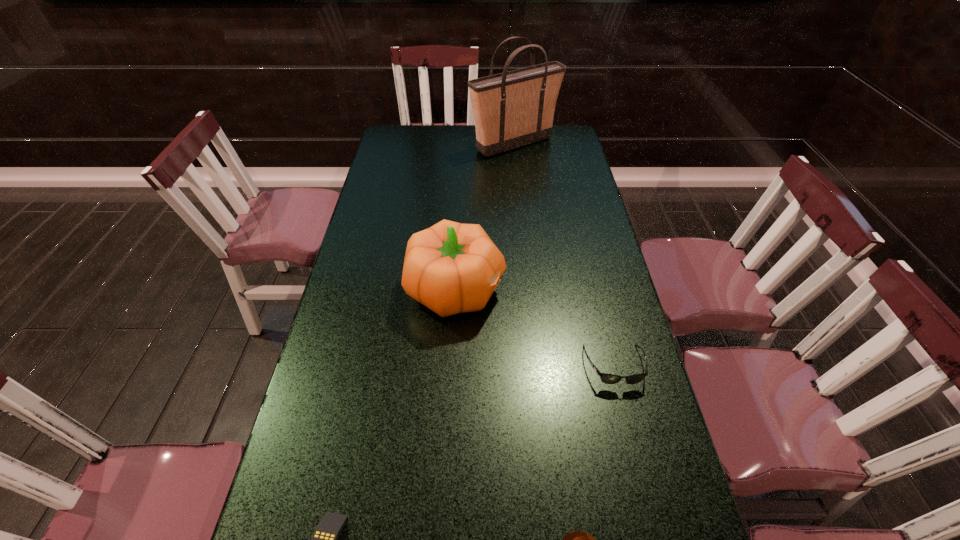
Locate an element on the screen. sunglasses that is at the right edge is located at coordinates (606, 378).

The height and width of the screenshot is (540, 960). Find the location of `object located at the far right corner`. object located at the far right corner is located at coordinates (512, 109).

What are the coordinates of `vacant space at the far edge of the desktop` in the screenshot? It's located at coord(467,140).

The height and width of the screenshot is (540, 960). In the image, there is a desktop. In order to click on vacant space at the left edge in this screenshot , I will do `click(406, 161)`.

This screenshot has width=960, height=540. What are the coordinates of `free space at the right edge of the desktop` in the screenshot? It's located at (653, 400).

You are a GUI agent. You are given a task and a screenshot of the screen. Output one action in this format:
    pyautogui.click(x=<x>, y=<y>)
    Task: Click on the free space at the far left corner of the desktop
    The width and height of the screenshot is (960, 540).
    Given the screenshot: What is the action you would take?
    pyautogui.click(x=414, y=141)

Locate an element on the screen. This screenshot has height=540, width=960. free space between the second tallest object and the tallest object is located at coordinates (486, 217).

Where is `empty location between the farthest object and the sunglasses`? empty location between the farthest object and the sunglasses is located at coordinates (564, 255).

This screenshot has height=540, width=960. I want to click on free space between the fourth shortest object and the sunglasses, so click(536, 327).

This screenshot has width=960, height=540. In order to click on vacant area between the shopping bag and the sunglasses in this screenshot , I will do `click(564, 255)`.